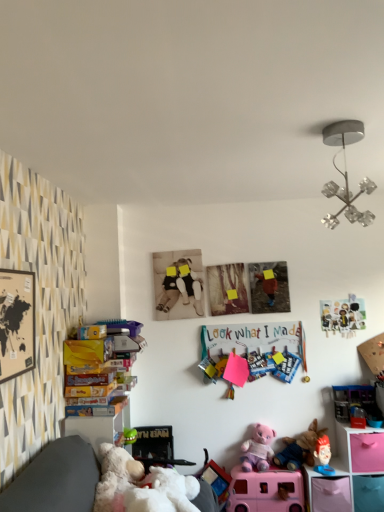
What is the approximate height of purple plush bear at center, placed as the 2th toy when sorted from bottom to top?

12.15 inches.

The image size is (384, 512). Identify the location of multicolored paper clips at center. (254, 349).

The width and height of the screenshot is (384, 512). In order to click on pink plastic shelf at lower right, which is the 1th shelf in bottom-to-top order in this screenshot , I will do `click(327, 490)`.

The image size is (384, 512). I want to click on purple plush bear at center, the 5th toy positioned from the top, so click(258, 449).

The image size is (384, 512). In order to click on lamp that is above the pink plastic toy car at lower right, which appears as the second toy when viewed from the top (from the image's perspective) in this screenshot , I will do pyautogui.click(x=346, y=174).

Could you tell me if metallic silver chandelier at upper right is turned towards pink plastic toy car at lower right, which is the fifth toy from bottom to top?

No, metallic silver chandelier at upper right does not turn towards pink plastic toy car at lower right, which is the fifth toy from bottom to top.

Considering the sizes of objects metallic silver chandelier at upper right and pink plastic toy car at lower right, which appears as the second toy when viewed from the top, in the image provided, who is smaller, metallic silver chandelier at upper right or pink plastic toy car at lower right, which appears as the second toy when viewed from the top,?

pink plastic toy car at lower right, which appears as the second toy when viewed from the top, is smaller.

Looking at this image, considering the relative positions of metallic silver chandelier at upper right and pink plastic toy car at lower right, which is the fifth toy from bottom to top, in the image provided, is metallic silver chandelier at upper right to the right of pink plastic toy car at lower right, which is the fifth toy from bottom to top, from the viewer's perspective?

No.

Consider the image. Can you confirm if plush fabric toy at lower right, which is the 4th toy from top to bottom, is positioned to the right of matte plastic picture frame at upper right, acting as the first toy starting from the top?

In fact, plush fabric toy at lower right, which is the 4th toy from top to bottom, is to the left of matte plastic picture frame at upper right, acting as the first toy starting from the top.

From a real-world perspective, which object rests below the other?

In real-world perspective, plush fabric toy at lower right, which is the 4th toy from top to bottom, is lower.

Based on the photo, can you confirm if plush fabric toy at lower right, which ranks as the third toy in bottom-to-top order, is thinner than matte plastic picture frame at upper right, the 6th toy ordered from the bottom?

In fact, plush fabric toy at lower right, which ranks as the third toy in bottom-to-top order, might be wider than matte plastic picture frame at upper right, the 6th toy ordered from the bottom.

Is point (344, 307) positioned before point (319, 430)?

No, it is behind (319, 430).

Is matte plastic picture frame at upper right, the 6th toy ordered from the bottom, surrounding fluffy plush toy at lower center, positioned as the fourth toy in bottom-to-top order?

That's incorrect, fluffy plush toy at lower center, positioned as the fourth toy in bottom-to-top order, is not inside matte plastic picture frame at upper right, the 6th toy ordered from the bottom.

What's the angular difference between matte plastic picture frame at upper right, the 6th toy ordered from the bottom, and fluffy plush toy at lower center, marked as the third toy in a top-to-bottom arrangement,'s facing directions?

The angular difference between matte plastic picture frame at upper right, the 6th toy ordered from the bottom, and fluffy plush toy at lower center, marked as the third toy in a top-to-bottom arrangement, is 0.412 degrees.

Is matte plastic picture frame at upper right, the 6th toy ordered from the bottom, taller or shorter than fluffy plush toy at lower center, marked as the third toy in a top-to-bottom arrangement?

In the image, matte plastic picture frame at upper right, the 6th toy ordered from the bottom, appears to be taller than fluffy plush toy at lower center, marked as the third toy in a top-to-bottom arrangement.

From the image's perspective, is black matte picture frame at left beneath purple plush bear at center, the 5th toy positioned from the top?

No, from the image's perspective, black matte picture frame at left is not below purple plush bear at center, the 5th toy positioned from the top.

Considering the relative sizes of black matte picture frame at left and purple plush bear at center, the 5th toy positioned from the top, in the image provided, is black matte picture frame at left bigger than purple plush bear at center, the 5th toy positioned from the top,?

Actually, black matte picture frame at left might be smaller than purple plush bear at center, the 5th toy positioned from the top.

Is black matte picture frame at left facing towards purple plush bear at center, placed as the 2th toy when sorted from bottom to top?

No, black matte picture frame at left is not turned towards purple plush bear at center, placed as the 2th toy when sorted from bottom to top.

Based on their positions, is black matte picture frame at left located to the left or right of purple plush bear at center, the 5th toy positioned from the top?

In the image, black matte picture frame at left appears on the left side of purple plush bear at center, the 5th toy positioned from the top.

From the picture: Who is smaller, matte plastic picture frame at upper right, the 6th toy ordered from the bottom, or purple plush bear at center, the 5th toy positioned from the top?

matte plastic picture frame at upper right, the 6th toy ordered from the bottom.

Is matte plastic picture frame at upper right, the 6th toy ordered from the bottom, to the left or to the right of purple plush bear at center, placed as the 2th toy when sorted from bottom to top, in the image?

matte plastic picture frame at upper right, the 6th toy ordered from the bottom, is positioned on purple plush bear at center, placed as the 2th toy when sorted from bottom to top,'s right side.

Which is closer to the camera, (355, 315) or (244, 441)?

Point (355, 315).

From a real-world perspective, who is located lower, matte plastic picture frame at upper right, acting as the first toy starting from the top, or purple plush bear at center, placed as the 2th toy when sorted from bottom to top?

From a 3D spatial view, purple plush bear at center, placed as the 2th toy when sorted from bottom to top, is below.

Are pink plastic toy car at lower right, which appears as the second toy when viewed from the top, and matte plastic picture frame at upper right, the 6th toy ordered from the bottom, located far from each other?

pink plastic toy car at lower right, which appears as the second toy when viewed from the top, is actually quite close to matte plastic picture frame at upper right, the 6th toy ordered from the bottom.

From a real-world perspective, which is physically below, pink plastic toy car at lower right, which appears as the second toy when viewed from the top, or matte plastic picture frame at upper right, acting as the first toy starting from the top?

From a 3D spatial view, pink plastic toy car at lower right, which appears as the second toy when viewed from the top, is below.

Is pink plastic toy car at lower right, which is the fifth toy from bottom to top, wider than matte plastic picture frame at upper right, acting as the first toy starting from the top?

Indeed, pink plastic toy car at lower right, which is the fifth toy from bottom to top, has a greater width compared to matte plastic picture frame at upper right, acting as the first toy starting from the top.

Does pink plastic toy car at lower right, which appears as the second toy when viewed from the top, lie behind matte plastic picture frame at upper right, acting as the first toy starting from the top?

No.

Which point is more distant from viewer, (344, 475) or (305, 454)?

Positioned behind is point (305, 454).

Which of these two, pink plastic shelf at lower right, which is the 1th shelf in bottom-to-top order, or fluffy plush toy at lower center, positioned as the fourth toy in bottom-to-top order, is bigger?

fluffy plush toy at lower center, positioned as the fourth toy in bottom-to-top order.

Is pink plastic shelf at lower right, which is the 1th shelf in bottom-to-top order, next to fluffy plush toy at lower center, positioned as the fourth toy in bottom-to-top order?

There is a gap between pink plastic shelf at lower right, which is the 1th shelf in bottom-to-top order, and fluffy plush toy at lower center, positioned as the fourth toy in bottom-to-top order.

How distant is pink plastic shelf at lower right, the second shelf in the top-to-bottom sequence, from fluffy plush toy at lower center, marked as the third toy in a top-to-bottom arrangement?

pink plastic shelf at lower right, the second shelf in the top-to-bottom sequence, is 19.28 centimeters away from fluffy plush toy at lower center, marked as the third toy in a top-to-bottom arrangement.

Locate an element on the screen. The image size is (384, 512). the 2nd toy below when counting from the metallic silver chandelier at upper right (from the image's perspective) is located at coordinates (355, 402).

Where is `the 4th toy above the plush fabric toy at lower right, which is the 4th toy from top to bottom (from a real-world perspective)`? The height and width of the screenshot is (512, 384). the 4th toy above the plush fabric toy at lower right, which is the 4th toy from top to bottom (from a real-world perspective) is located at coordinates (343, 315).

Looking at the image, which one is located closer to pink plastic shelf at lower right, which is the 1th shelf in bottom-to-top order, pink plastic toy car at lower right, which is the fifth toy from bottom to top, or black matte picture frame at left?

pink plastic toy car at lower right, which is the fifth toy from bottom to top.

Considering their positions, is metallic silver chandelier at upper right positioned closer to white plush teddy bear at lower left than pink plastic toy car at lower center, which is counted as the sixth toy, starting from the top?

pink plastic toy car at lower center, which is counted as the sixth toy, starting from the top, is positioned closer to the anchor white plush teddy bear at lower left.

From the image, which object appears to be nearer to matte plastic picture frame at upper right, the 6th toy ordered from the bottom, pink plastic shelf at lower right, which ranks as the second shelf in bottom-to-top order, or pink plastic shelf at lower right, which is the 1th shelf in bottom-to-top order?

The object closer to matte plastic picture frame at upper right, the 6th toy ordered from the bottom, is pink plastic shelf at lower right, which ranks as the second shelf in bottom-to-top order.

Which object lies further to the anchor point fluffy plush toy at lower center, marked as the third toy in a top-to-bottom arrangement, multicolored paper clips at center or pink plastic shelf at lower right, which is the 1th shelf in top-to-bottom order?

Among the two, multicolored paper clips at center is located further to fluffy plush toy at lower center, marked as the third toy in a top-to-bottom arrangement.

From the image, which object appears to be farther from black matte picture frame at left, pink plastic toy car at lower right, which appears as the second toy when viewed from the top, or purple plush bear at center, placed as the 2th toy when sorted from bottom to top?

Among the two, pink plastic toy car at lower right, which appears as the second toy when viewed from the top, is located further to black matte picture frame at left.

Based on their spatial positions, is purple plush bear at center, placed as the 2th toy when sorted from bottom to top, or fluffy plush toy at lower center, marked as the third toy in a top-to-bottom arrangement, further from pink plastic shelf at lower right, which is the 1th shelf in top-to-bottom order?

purple plush bear at center, placed as the 2th toy when sorted from bottom to top, is further to pink plastic shelf at lower right, which is the 1th shelf in top-to-bottom order.

Looking at the image, which one is located further to white plush teddy bear at lower left, plush fabric toy at lower right, which is the 4th toy from top to bottom, or pink plastic toy car at lower center, which is counted as the sixth toy, starting from the top?

plush fabric toy at lower right, which is the 4th toy from top to bottom.

When comparing their distances from multicolored paper clips at center, does plush fabric toy at lower right, which is the 4th toy from top to bottom, or pink plastic shelf at lower right, which is the 1th shelf in top-to-bottom order, seem further?

pink plastic shelf at lower right, which is the 1th shelf in top-to-bottom order, is positioned further to the anchor multicolored paper clips at center.

Identify the location of picture frame between metallic silver chandelier at upper right and white fabric couch at lower left from top to bottom. (16, 323).

Find the location of a particular element. This screenshot has height=512, width=384. shelf between pink plastic toy car at lower center, which is counted as the sixth toy, starting from the top, and pink plastic shelf at lower right, which ranks as the second shelf in bottom-to-top order, from left to right is located at coordinates (327, 490).

Find the location of a particular element. This screenshot has width=384, height=512. couch between black matte picture frame at left and pink plastic toy car at lower right, which appears as the second toy when viewed from the top is located at coordinates (49, 474).

The image size is (384, 512). I want to click on toy between black matte picture frame at left and pink plastic toy car at lower center, which is counted as the sixth toy, starting from the top, in the horizontal direction, so click(258, 449).